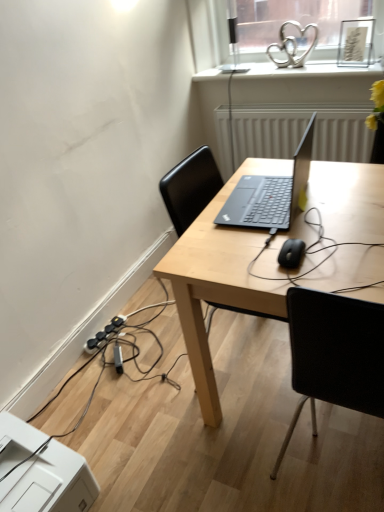
Locate an element on the screen. blank space above light wood desk at center (from a real-world perspective) is located at coordinates (310, 213).